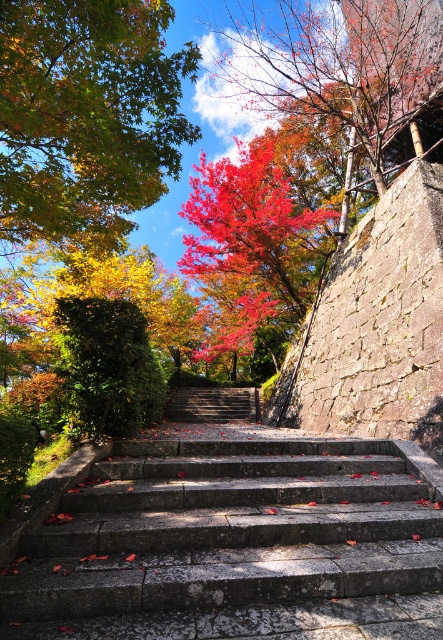
You are a hiker standing at the bottom of the gray stone stairs at center and want to reach the shiny red leaves at upper center. Which direction should you move relative to the stairs to get there?

The shiny red leaves at upper center are to the right of the gray stone stairs at center, so you should move to the right side of the stairs to reach them.